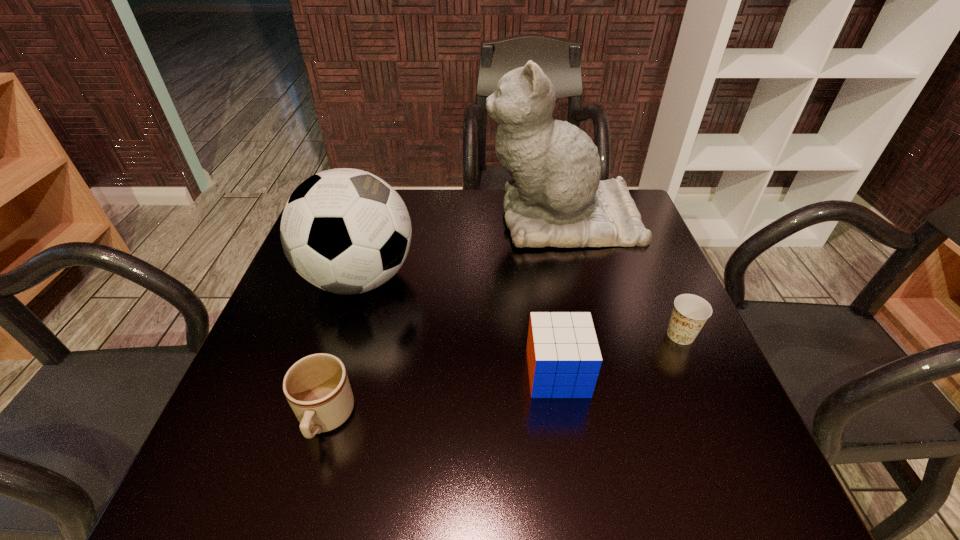
I want to click on free space located on the back of the cube, so click(541, 269).

This screenshot has height=540, width=960. What are the coordinates of `vacant position located 0.060m on the side of the mug with the handle` in the screenshot? It's located at (304, 493).

Where is `vacant area located on the left of the third nearest object`? The height and width of the screenshot is (540, 960). vacant area located on the left of the third nearest object is located at coordinates (510, 335).

What are the coordinates of `object present at the far edge` in the screenshot? It's located at (555, 197).

You are a GUI agent. You are given a task and a screenshot of the screen. Output one action in this format:
    pyautogui.click(x=<x>, y=<y>)
    Task: Click on the object that is at the near edge
    
    Given the screenshot: What is the action you would take?
    pyautogui.click(x=317, y=388)

At what (x,y) coordinates should I click in order to perform the action: click on soccer ball that is positioned at the left edge. Please return your answer as a coordinate pair (x, y). Looking at the image, I should click on (346, 231).

In order to click on mug that is at the left edge in this screenshot , I will do `click(317, 388)`.

I want to click on cat positioned at the right edge, so click(555, 197).

The height and width of the screenshot is (540, 960). What are the coordinates of `Dixie cup that is at the right edge` in the screenshot? It's located at (690, 312).

At what (x,y) coordinates should I click in order to perform the action: click on object positioned at the near left corner. Please return your answer as a coordinate pair (x, y). Looking at the image, I should click on (317, 388).